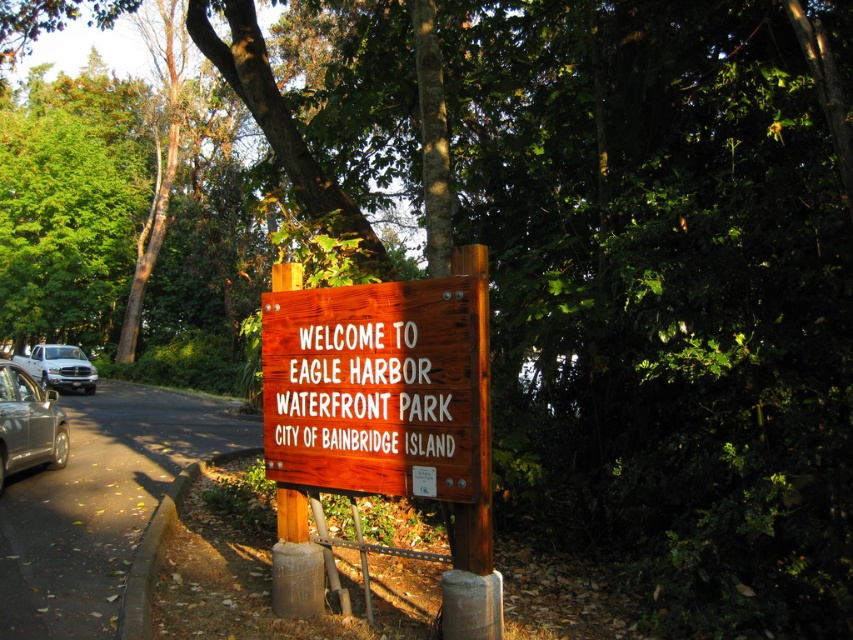
Question: Which of the following is the closest to the observer?

Choices:
 (A) (48, 378)
 (B) (302, 332)

Answer: (B)

Question: Which object is the farthest from the silver metallic car at left?

Choices:
 (A) white matte truck at left
 (B) wooden sign at center

Answer: (A)

Question: Is silver metallic car at left bigger than white matte truck at left?

Choices:
 (A) no
 (B) yes

Answer: (A)

Question: Does silver metallic car at left have a smaller size compared to white matte truck at left?

Choices:
 (A) yes
 (B) no

Answer: (A)

Question: Estimate the real-world distances between objects in this image. Which object is farther from the white matte truck at left?

Choices:
 (A) silver metallic car at left
 (B) wooden sign at center

Answer: (B)

Question: Is the position of wooden sign at center less distant than that of silver metallic car at left?

Choices:
 (A) no
 (B) yes

Answer: (B)